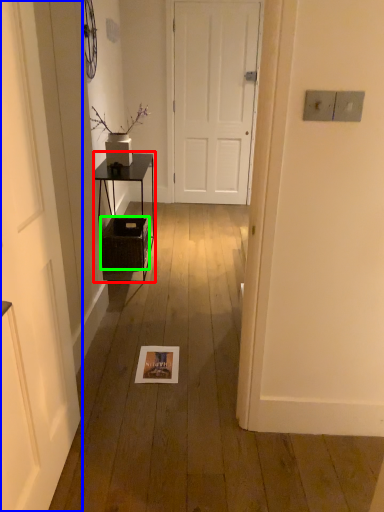
Question: Which object is the closest to the table (highlighted by a red box)? Choose among these: door (highlighted by a blue box) or crate (highlighted by a green box).

Choices:
 (A) door
 (B) crate

Answer: (B)